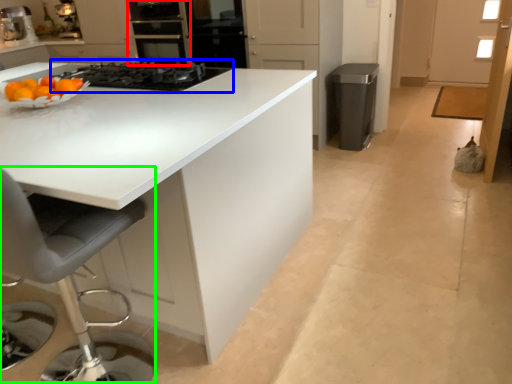
Question: Based on their relative distances, which object is nearer to oven (highlighted by a red box)? Choose from gas stove (highlighted by a blue box) and swivel chair (highlighted by a green box).

Choices:
 (A) gas stove
 (B) swivel chair

Answer: (A)